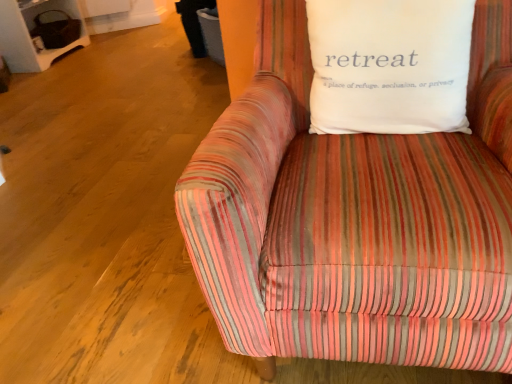
Where is `vacant region to the left of striped fabric couch at center`? This screenshot has height=384, width=512. vacant region to the left of striped fabric couch at center is located at coordinates (116, 269).